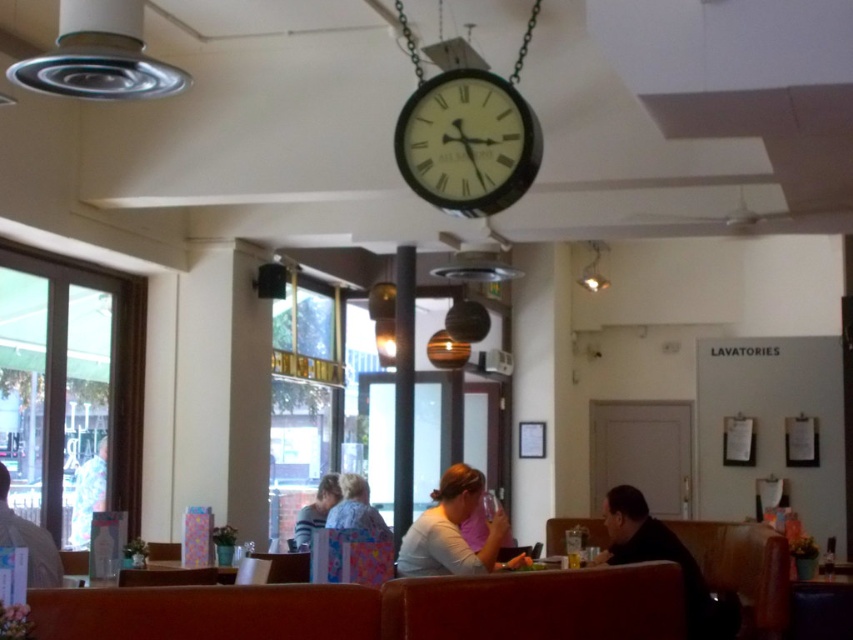
Can you confirm if black matte shirt at lower right is positioned to the left of printed fabric shirt at center?

No, black matte shirt at lower right is not to the left of printed fabric shirt at center.

Which of these two, black matte shirt at lower right or printed fabric shirt at center, stands shorter?

printed fabric shirt at center is shorter.

Measure the distance between point (x=647, y=518) and camera.

Point (x=647, y=518) and camera are 15.18 feet apart from each other.

Identify the location of black matte shirt at lower right. (653, 552).

Does matte white shirt at center have a lesser width compared to printed fabric shirt at center?

Indeed, matte white shirt at center has a lesser width compared to printed fabric shirt at center.

Can you confirm if matte white shirt at center is positioned to the right of printed fabric shirt at center?

Indeed, matte white shirt at center is positioned on the right side of printed fabric shirt at center.

Which is in front, point (498, 522) or point (350, 476)?

Point (498, 522) is in front.

This screenshot has height=640, width=853. In order to click on matte white shirt at center in this screenshot , I will do `click(451, 531)`.

Who is more forward, (422, 172) or (461, 499)?

Positioned in front is point (422, 172).

Which is below, metallic silver clock at upper center or matte white shirt at center?

matte white shirt at center

Is point (495, 109) closer to camera compared to point (451, 465)?

That is True.

Identify the location of metallic silver clock at upper center. (467, 141).